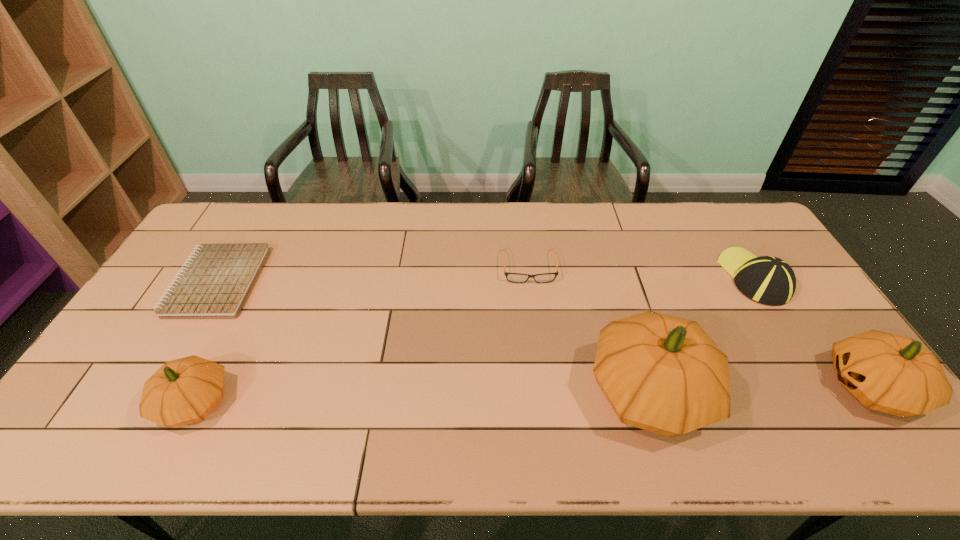
This screenshot has height=540, width=960. I want to click on free space located 0.060m on the side of the leftmost gourd with the carved face, so click(x=133, y=402).

Locate an element on the screen. blank space located 0.190m on the side of the leftmost gourd with the carved face is located at coordinates (81, 402).

At what (x,y) coordinates should I click in order to perform the action: click on vacant space situated 0.170m on the side of the leftmost gourd with the carved face. Please return your answer as a coordinate pair (x, y). This screenshot has height=540, width=960. Looking at the image, I should click on (88, 402).

Identify the location of free space located on the side of the fourth object from left to right with the carved face. Image resolution: width=960 pixels, height=540 pixels. (865, 392).

This screenshot has height=540, width=960. I want to click on free space located 0.190m on the side of the fifth shortest object with the carved face, so click(x=751, y=387).

Find the location of `free space located 0.180m on the side of the fifth shortest object with the carved face`. free space located 0.180m on the side of the fifth shortest object with the carved face is located at coordinates (755, 387).

I want to click on free point located 0.380m on the side of the fifth shortest object with the carved face, so click(x=675, y=387).

Find the location of a particular element. The image size is (960, 540). free space located with the brim of the third shortest object facing forward is located at coordinates (720, 222).

Locate an element on the screen. The width and height of the screenshot is (960, 540). vacant space situated 0.270m with the brim of the third shortest object facing forward is located at coordinates (708, 204).

The image size is (960, 540). I want to click on free space located with the brim of the third shortest object facing forward, so click(x=721, y=224).